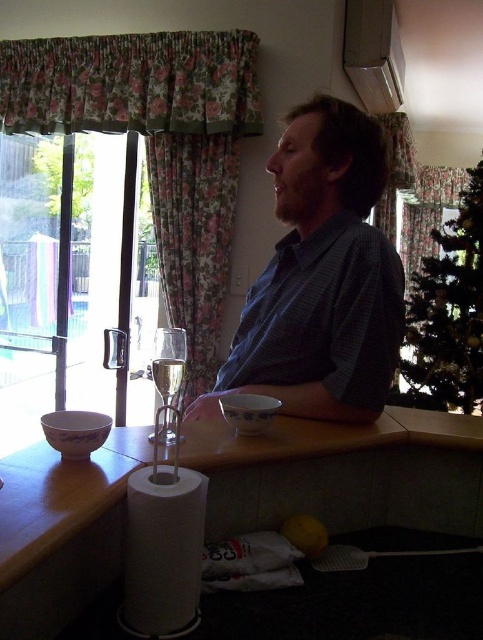
Question: Which point is farther from the camera taking this photo?

Choices:
 (A) (39, 348)
 (B) (330, 400)

Answer: (A)

Question: Can you confirm if transparent glass door at left is positioned to the right of white paper towel at lower left?

Choices:
 (A) yes
 (B) no

Answer: (B)

Question: Does white paper towel at lower left appear on the right side of clear glass wine glass at center?

Choices:
 (A) yes
 (B) no

Answer: (A)

Question: Which object is farther from the camera taking this photo?

Choices:
 (A) clear glass champagne flute at center
 (B) clear glass wine glass at center
 (C) transparent glass door at left
 (D) blue checkered shirt at center

Answer: (C)

Question: In this image, where is transparent glass door at left located relative to clear glass champagne flute at center?

Choices:
 (A) left
 (B) right

Answer: (A)

Question: Which point is closer to the camera?

Choices:
 (A) click(x=343, y=403)
 (B) click(x=30, y=138)
 (C) click(x=152, y=632)
 (D) click(x=170, y=348)

Answer: (C)